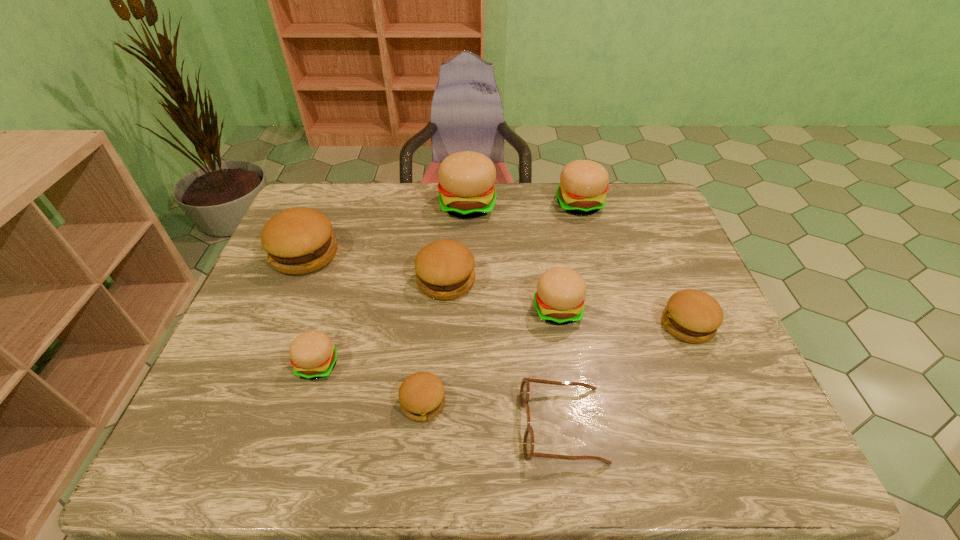
The width and height of the screenshot is (960, 540). Identify the location of the second beige hamburger from left to right. (466, 187).

I want to click on the tallest hamburger, so click(x=466, y=187).

I want to click on the second biggest beige hamburger, so click(x=583, y=185).

Image resolution: width=960 pixels, height=540 pixels. I want to click on the biggest brown hamburger, so click(x=298, y=241).

Where is `the second smallest beige hamburger`? The width and height of the screenshot is (960, 540). the second smallest beige hamburger is located at coordinates (560, 296).

At what (x,y) coordinates should I click in order to perform the action: click on the third smallest brown hamburger. Please return your answer as a coordinate pair (x, y). The image size is (960, 540). Looking at the image, I should click on (444, 269).

This screenshot has width=960, height=540. Identify the location of the second nearest brown hamburger. (693, 316).

Find the location of a particular element. Image resolution: width=960 pixels, height=540 pixels. the rightmost brown hamburger is located at coordinates (693, 316).

Where is `the smallest beige hamburger`? The image size is (960, 540). the smallest beige hamburger is located at coordinates (312, 354).

Locate an element on the screen. the leftmost beige hamburger is located at coordinates (312, 354).